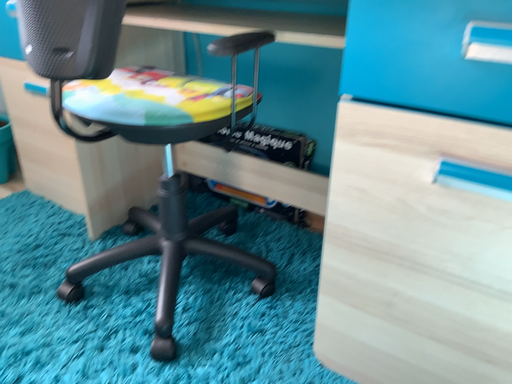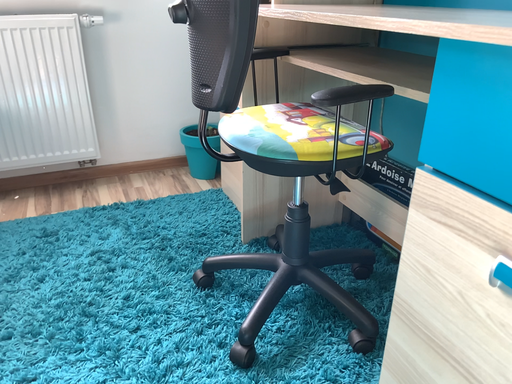
Question: Which way did the camera rotate in the video?

Choices:
 (A) rotated left
 (B) rotated right

Answer: (A)